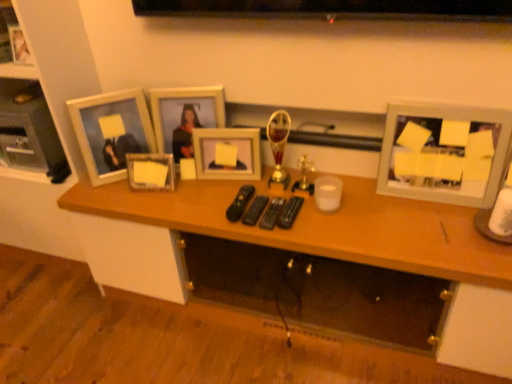
You are a GUI agent. You are given a task and a screenshot of the screen. Output one action in this format:
    pyautogui.click(x=<x>, y=<y>)
    Task: Click on the vacant area located to the right-hand side of black plastic remote at center, arranged as the fourth remote control when viewed from the right
    
    Given the screenshot: What is the action you would take?
    pyautogui.click(x=291, y=202)